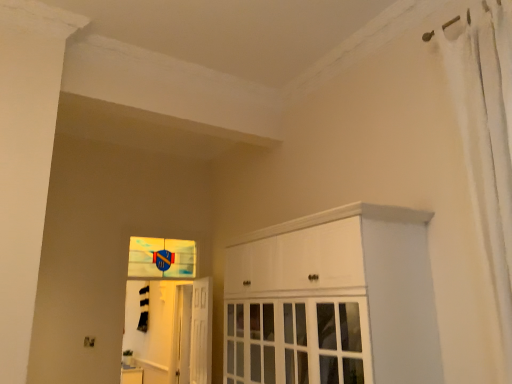
Question: Does white glossy cabinet at center turn towards white glossy door at center?

Choices:
 (A) no
 (B) yes

Answer: (A)

Question: Does white glossy cabinet at center touch white glossy door at center?

Choices:
 (A) no
 (B) yes

Answer: (A)

Question: Is white glossy cabinet at center taller than white glossy door at center?

Choices:
 (A) no
 (B) yes

Answer: (B)

Question: Does white glossy cabinet at center have a greater width compared to white glossy door at center?

Choices:
 (A) yes
 (B) no

Answer: (A)

Question: From the image's perspective, is white glossy cabinet at center under white glossy door at center?

Choices:
 (A) no
 (B) yes

Answer: (A)

Question: Is white fabric shower curtain at right wider or thinner than white glossy door at center?

Choices:
 (A) thin
 (B) wide

Answer: (B)

Question: Is white fabric shower curtain at right taller or shorter than white glossy door at center?

Choices:
 (A) tall
 (B) short

Answer: (A)

Question: From the image's perspective, relative to white glossy door at center, is white fabric shower curtain at right above or below?

Choices:
 (A) below
 (B) above

Answer: (B)

Question: Based on their sizes in the image, would you say white fabric shower curtain at right is bigger or smaller than white glossy door at center?

Choices:
 (A) big
 (B) small

Answer: (A)

Question: In the image, is translucent glass screen door at lower left on the left side or the right side of white fabric shower curtain at right?

Choices:
 (A) left
 (B) right

Answer: (A)

Question: Is point (182, 345) positioned closer to the camera than point (502, 286)?

Choices:
 (A) farther
 (B) closer

Answer: (A)

Question: From a real-world perspective, relative to white fabric shower curtain at right, is translucent glass screen door at lower left vertically above or below?

Choices:
 (A) below
 (B) above

Answer: (A)

Question: From the image's perspective, relative to white fabric shower curtain at right, is translucent glass screen door at lower left above or below?

Choices:
 (A) below
 (B) above

Answer: (A)

Question: Is white fabric shower curtain at right taller or shorter than blue glass window at center?

Choices:
 (A) short
 (B) tall

Answer: (B)

Question: Based on their sizes in the image, would you say white fabric shower curtain at right is bigger or smaller than blue glass window at center?

Choices:
 (A) small
 (B) big

Answer: (B)